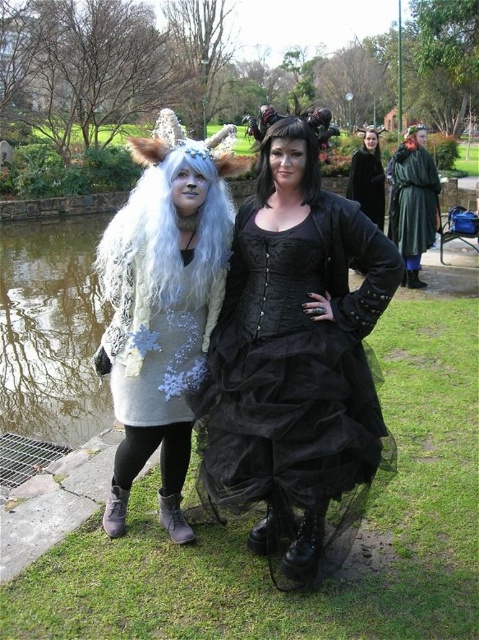
Can you confirm if black tulle dress at center is positioned to the left of black satin wig at center?

Incorrect, black tulle dress at center is not on the left side of black satin wig at center.

Does point (243, 273) lie behind point (310, 179)?

That is True.

Identify the location of black tulle dress at center. (294, 362).

Between transparent glass pond at left and white fluffy wig at left, which one has more height?

With more height is white fluffy wig at left.

Does transparent glass pond at left come behind white fluffy wig at left?

Yes, it is behind white fluffy wig at left.

Which is in front, point (43, 250) or point (138, 268)?

Positioned in front is point (138, 268).

Image resolution: width=479 pixels, height=640 pixels. Find the location of `transparent glass pond at left`. transparent glass pond at left is located at coordinates (50, 330).

Can you confirm if fuzzy white fur coat at left is positioned above green velvet cloak at right?

No, fuzzy white fur coat at left is not above green velvet cloak at right.

Is fuzzy white fur coat at left taller than green velvet cloak at right?

No.

Who is more distant from viewer, (x=172, y=262) or (x=424, y=179)?

The point (x=424, y=179) is behind.

Where is `fuzzy white fur coat at left`? The height and width of the screenshot is (640, 479). fuzzy white fur coat at left is located at coordinates (162, 305).